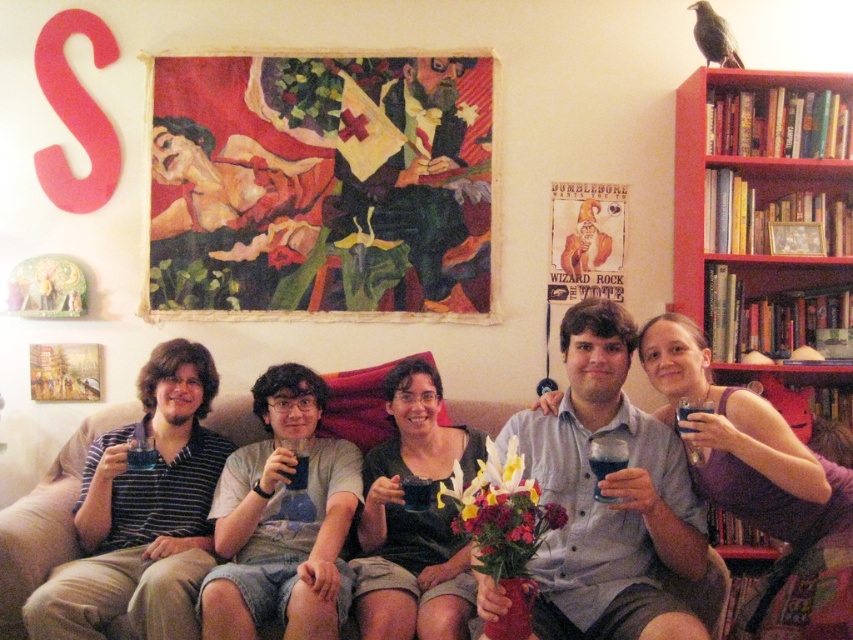
Question: In this image, where is red wood bookshelf at upper right located relative to translucent glass cup at center?

Choices:
 (A) left
 (B) right

Answer: (B)

Question: Is translucent glass cup at center bigger than clear plastic cup at left?

Choices:
 (A) no
 (B) yes

Answer: (B)

Question: Which object is closer to the camera taking this photo?

Choices:
 (A) clear plastic cup at center
 (B) gray cotton t-shirt at center
 (C) black matte dress at center

Answer: (C)

Question: Estimate the real-world distances between objects in this image. Which object is farther from the black matte dress at center?

Choices:
 (A) translucent plastic cup at center
 (B) clear plastic cup at center
 (C) matte purple tank top at center

Answer: (B)

Question: Which point is farther to the camera?

Choices:
 (A) red wood bookshelf at upper right
 (B) translucent plastic cup at center
 (C) clear plastic cup at left
 (D) black matte dress at center

Answer: (A)

Question: Considering the relative positions of matte purple tank top at center and translucent glass cup at center in the image provided, where is matte purple tank top at center located with respect to translucent glass cup at center?

Choices:
 (A) below
 (B) above

Answer: (B)